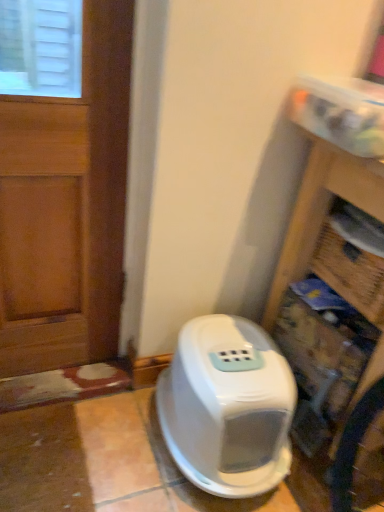
Describe the element at coordinates (67, 207) in the screenshot. I see `wooden door at left` at that location.

Identify the location of white plastic litter box at lower center. This screenshot has width=384, height=512. (227, 407).

Where is `wooden bookshelf at right`? This screenshot has height=512, width=384. wooden bookshelf at right is located at coordinates (337, 287).

From the picture: Which is nearer, (x=245, y=352) or (x=9, y=147)?

Point (x=9, y=147)

Between white plastic litter box at lower center and wooden door at left, which one has smaller width?

wooden door at left.

Is white plastic litter box at lower center to the left of wooden door at left from the viewer's perspective?

Incorrect, white plastic litter box at lower center is not on the left side of wooden door at left.

Is white plastic litter box at lower center directly adjacent to wooden bookshelf at right?

white plastic litter box at lower center is not next to wooden bookshelf at right, and they're not touching.

Which is more to the left, white plastic litter box at lower center or wooden bookshelf at right?

white plastic litter box at lower center.

Could you tell me if white plastic litter box at lower center is turned towards wooden bookshelf at right?

No, white plastic litter box at lower center is not facing towards wooden bookshelf at right.

Considering the relative sizes of wooden bookshelf at right and wooden door at left in the image provided, is wooden bookshelf at right bigger than wooden door at left?

Indeed, wooden bookshelf at right has a larger size compared to wooden door at left.

Considering the points (302, 201) and (79, 307), which point is in front, point (302, 201) or point (79, 307)?

Point (302, 201)

From a real-world perspective, who is located lower, wooden bookshelf at right or wooden door at left?

wooden bookshelf at right.

From a real-world perspective, is wooden door at left positioned above or below wooden bookshelf at right?

wooden door at left is situated higher than wooden bookshelf at right in the real world.

What's the angular difference between wooden door at left and wooden bookshelf at right's facing directions?

The angle between the facing direction of wooden door at left and the facing direction of wooden bookshelf at right is 89 degrees.

Which object is positioned more to the left, wooden door at left or wooden bookshelf at right?

wooden door at left.

Which is closer to the camera, (34, 138) or (372, 104)?

Point (34, 138) is farther from the camera than point (372, 104).

Locate an element on the screen. door above the white plastic litter box at lower center (from the image's perspective) is located at coordinates (67, 207).

Does wooden door at left have a smaller size compared to white plastic litter box at lower center?

Yes, wooden door at left is smaller than white plastic litter box at lower center.

From the image's perspective, which one is positioned higher, wooden door at left or white plastic litter box at lower center?

wooden door at left appears higher in the image.

Is point (8, 98) positioned behind point (159, 419)?

No, (8, 98) is closer to viewer.

From the image's perspective, which object appears higher, wooden bookshelf at right or white plastic litter box at lower center?

wooden bookshelf at right is shown above in the image.

Does wooden bookshelf at right have a larger size compared to white plastic litter box at lower center?

Yes, wooden bookshelf at right is bigger than white plastic litter box at lower center.

Between wooden bookshelf at right and white plastic litter box at lower center, which one has less height?

white plastic litter box at lower center.

Could you tell me if wooden bookshelf at right is turned towards white plastic litter box at lower center?

Yes, wooden bookshelf at right is turned towards white plastic litter box at lower center.

Locate an element on the screen. Image resolution: width=384 pixels, height=512 pixels. home appliance below the wooden door at left (from a real-world perspective) is located at coordinates (227, 407).

The width and height of the screenshot is (384, 512). In order to click on bookshelf above the white plastic litter box at lower center (from a real-world perspective) in this screenshot , I will do `click(337, 287)`.

In the scene shown: Considering their positions, is wooden door at left positioned closer to white plastic litter box at lower center than wooden bookshelf at right?

wooden bookshelf at right.

From the image, which object appears to be farther from wooden door at left, wooden bookshelf at right or white plastic litter box at lower center?

wooden bookshelf at right is further to wooden door at left.

Considering their positions, is wooden door at left positioned further to wooden bookshelf at right than white plastic litter box at lower center?

wooden door at left.

When comparing their distances from wooden door at left, does white plastic litter box at lower center or wooden bookshelf at right seem closer?

Among the two, white plastic litter box at lower center is located nearer to wooden door at left.

Considering their positions, is white plastic litter box at lower center positioned further to wooden bookshelf at right than wooden door at left?

wooden door at left is further to wooden bookshelf at right.

Considering their positions, is wooden bookshelf at right positioned further to white plastic litter box at lower center than wooden door at left?

wooden door at left is further to white plastic litter box at lower center.

What are the coordinates of `home appliance between wooden door at left and wooden bookshelf at right` in the screenshot? It's located at (227, 407).